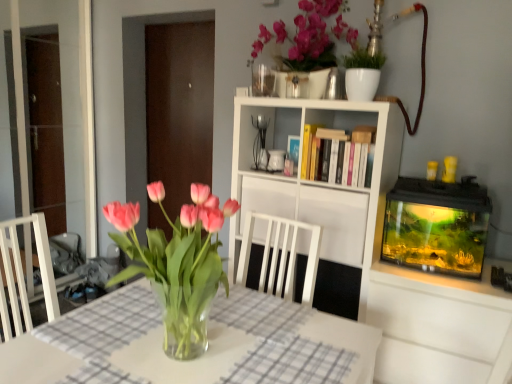
Question: In the image, is transparent glass door at left, which is the 1th glass door from left to right, positioned in front of or behind pink glass vase at center?

Choices:
 (A) front
 (B) behind

Answer: (B)

Question: From the image's perspective, is transparent glass door at left, the second glass door from the right, positioned above or below pink glass vase at center?

Choices:
 (A) above
 (B) below

Answer: (A)

Question: Considering the real-world distances, which object is farthest from the transparent glass door at center, the 2th glass door from the left?

Choices:
 (A) white matte cabinet at center
 (B) transparent glass door at left, which is the 1th glass door from left to right
 (C) pink glass vase at center
 (D) clear glass vase at center
 (E) white matte bookshelf at center

Answer: (C)

Question: Which object is the closest to the pink glass vase at center?

Choices:
 (A) hardcover books at center
 (B) white matte bookshelf at center
 (C) transparent glass door at left, the second glass door from the right
 (D) white matte cabinet at center
 (E) clear glass vase at center

Answer: (E)